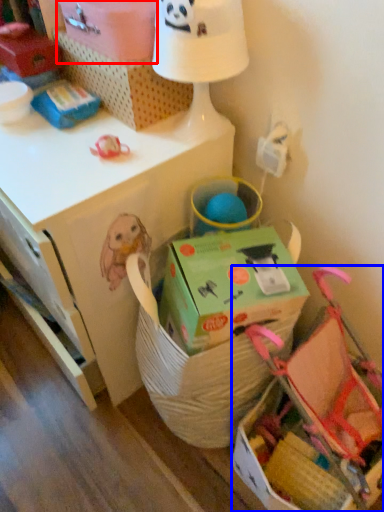
Question: Which point is closer to the camera, cardboard box (highlighted by a red box) or baby carriage (highlighted by a blue box)?

Choices:
 (A) cardboard box
 (B) baby carriage

Answer: (B)